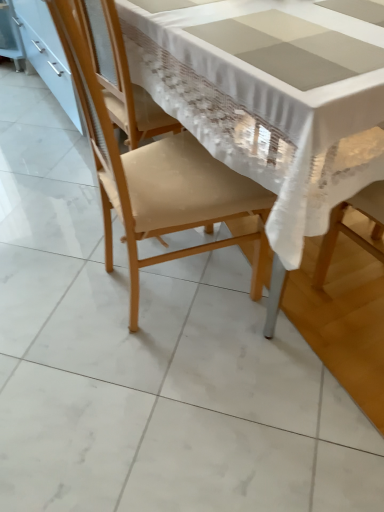
Image resolution: width=384 pixels, height=512 pixels. I want to click on free space to the left of matte beige chair at center, so click(x=57, y=282).